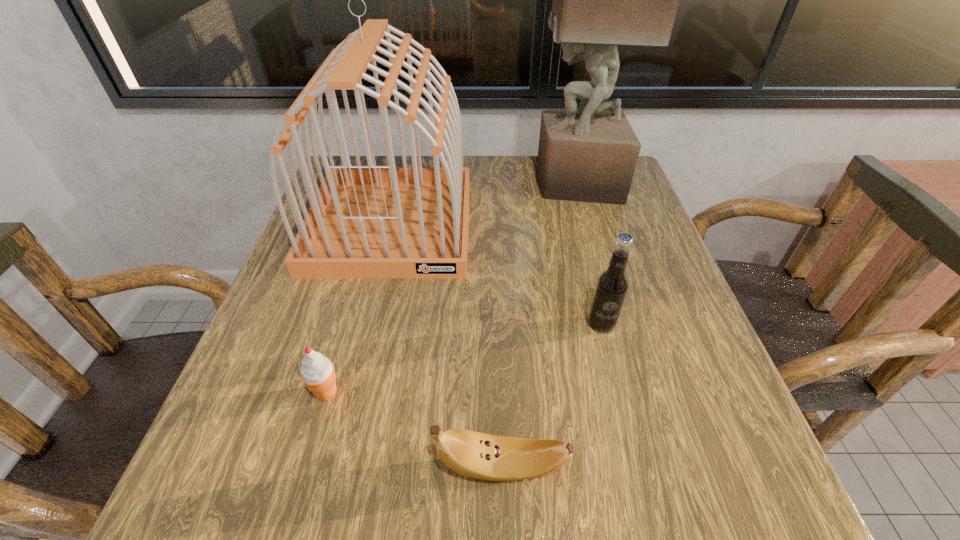
You are a GUI agent. You are given a task and a screenshot of the screen. Output one action in this format:
    pyautogui.click(x=<x>, y=<y>)
    Task: Click on the free space located on the label of the third tallest object
    This screenshot has width=960, height=540.
    Given the screenshot: What is the action you would take?
    pyautogui.click(x=651, y=520)

Image resolution: width=960 pixels, height=540 pixels. In order to click on vacant area located on the right of the icecream in this screenshot , I will do `click(513, 393)`.

At what (x,y) coordinates should I click in order to perform the action: click on blank area located 0.350m on the back of the banana. Please return your answer as a coordinate pair (x, y). The image size is (960, 540). Looking at the image, I should click on (495, 274).

Find the location of a particular element. sculpture present at the far edge is located at coordinates (600, 0).

Identify the location of birdcage situated at the far edge. This screenshot has width=960, height=540. (371, 221).

You are a GUI agent. You are given a task and a screenshot of the screen. Output one action in this format:
    pyautogui.click(x=<x>, y=<y>)
    Task: Click on the object that is at the near edge
    This screenshot has width=960, height=540.
    Given the screenshot: What is the action you would take?
    pyautogui.click(x=478, y=455)

Where is `birdcage at the left edge`? The width and height of the screenshot is (960, 540). birdcage at the left edge is located at coordinates (371, 221).

Locate an element on the screen. The height and width of the screenshot is (540, 960). icecream situated at the left edge is located at coordinates (317, 372).

Where is `sculpture that is at the right edge`? The width and height of the screenshot is (960, 540). sculpture that is at the right edge is located at coordinates (600, 0).

This screenshot has width=960, height=540. Find the location of `root beer that is at the right edge`. root beer that is at the right edge is located at coordinates (612, 284).